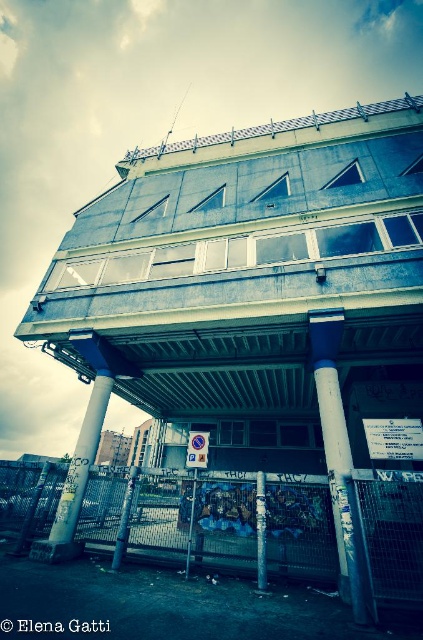
Can you confirm if blue painted metal pole at center is positioned to the left of gray concrete pillar at lower left?

In fact, blue painted metal pole at center is to the right of gray concrete pillar at lower left.

In order to click on blue painted metal pole at center in this screenshot , I will do `click(340, 461)`.

Measure the distance between point (357,545) and camera.

A distance of 22.71 feet exists between point (357,545) and camera.

Identify the location of blue painted metal pole at center. (340, 461).

Is gray concrete pillar at lower left taller than white glossy pillar at center?

Yes.

Does point (90, 429) come in front of point (260, 554)?

No.

Does point (71, 506) come closer to viewer compared to point (260, 577)?

No, it is not.

The image size is (423, 640). I want to click on gray concrete pillar at lower left, so click(x=80, y=461).

Describe the element at coordinates (392, 536) in the screenshot. I see `rusty metal fence at lower center` at that location.

Is rusty metal fence at lower center below gray concrete pillar at lower left?

Yes.

Is point (255, 502) closer to camera compared to point (79, 451)?

Yes, point (255, 502) is in front of point (79, 451).

In order to click on rusty metal fence at lower center in this screenshot , I will do `click(392, 536)`.